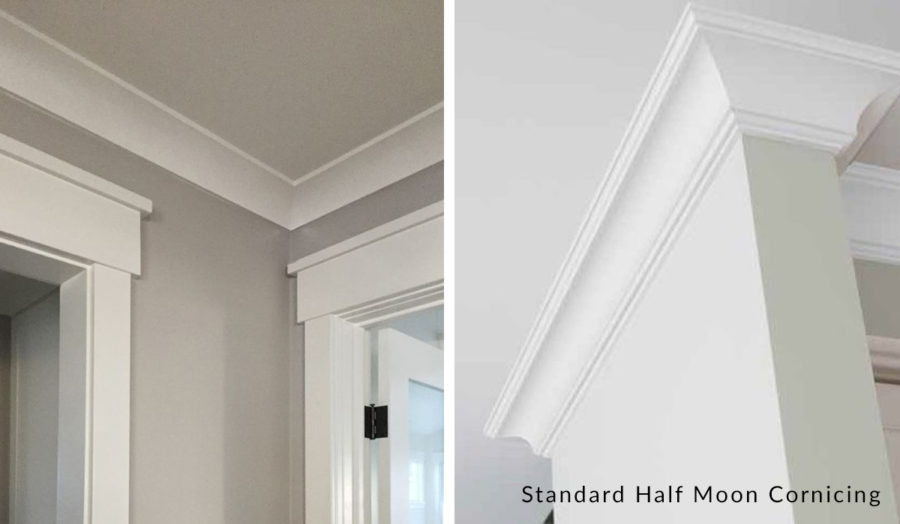
The height and width of the screenshot is (524, 900). Identify the location of doorway. (72, 472).